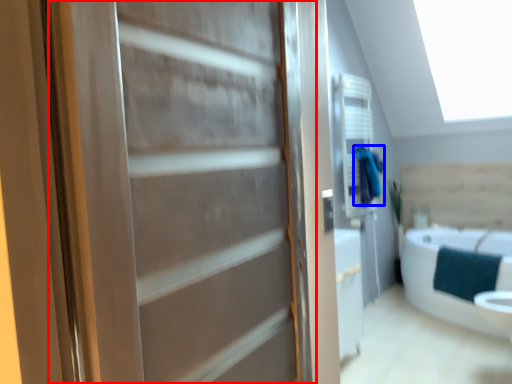
Question: Which object is closer to the camera taking this photo, door (highlighted by a red box) or bathrobe (highlighted by a blue box)?

Choices:
 (A) door
 (B) bathrobe

Answer: (A)